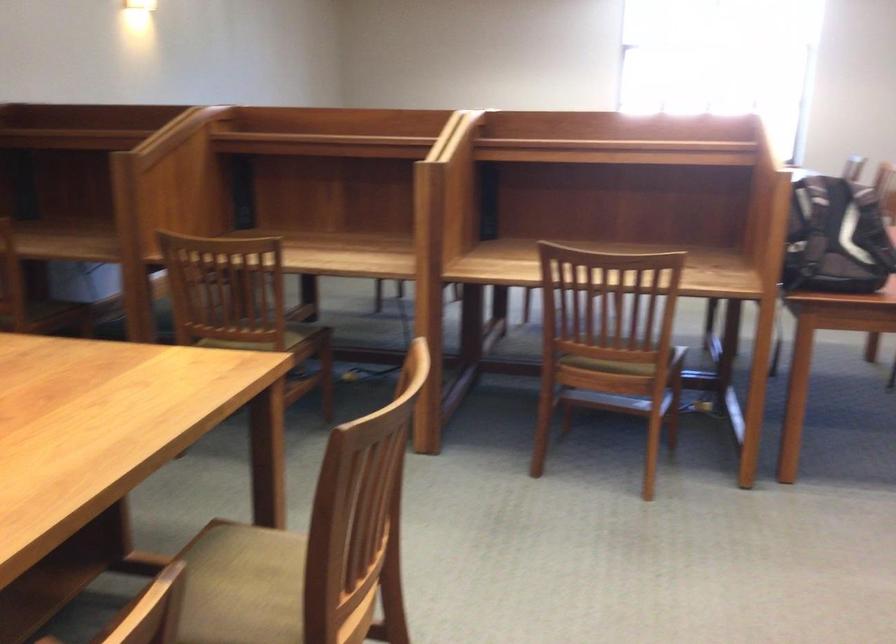
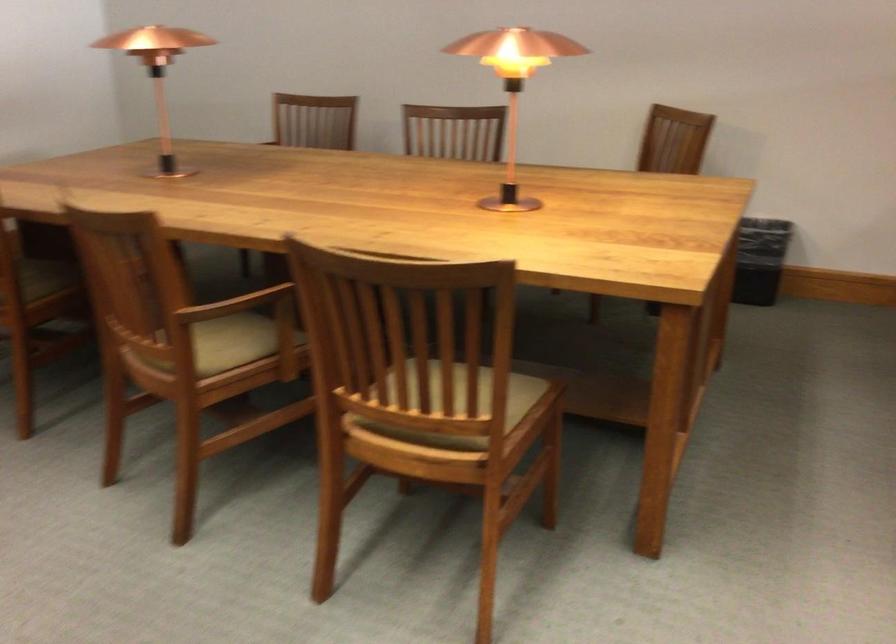
Find the pixel in the second image that matches the point at 383,518 in the first image.

(460, 404)